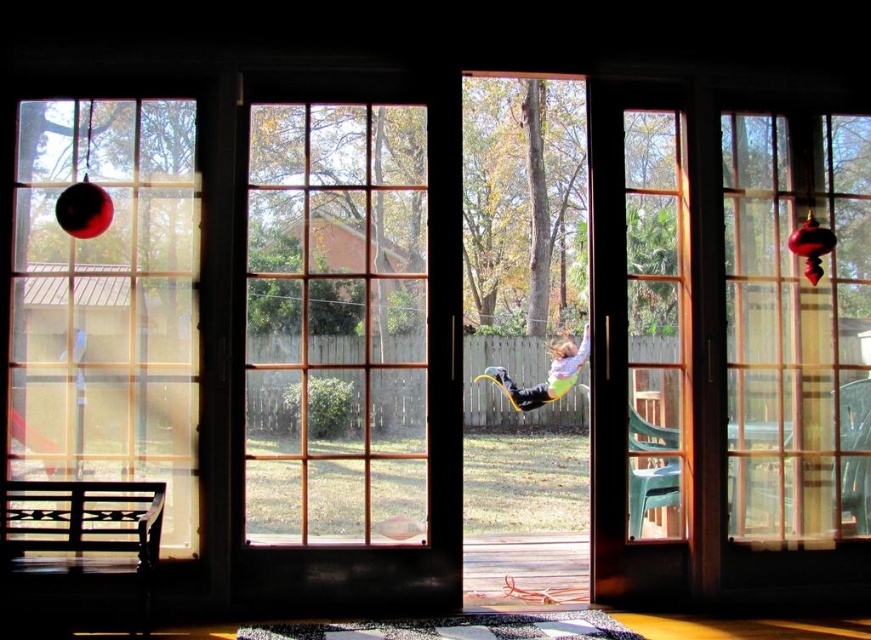
You are standing inside the house looking through the French doors. You see the multicolored plastic swing at center and the shiny red ornament at left. Which object is positioned lower in the scene?

The multicolored plastic swing at center is positioned lower than the shiny red ornament at left.

You are planning to hang a new decoration in your backyard. You have two options from the image, the multicolored plastic swing at center and the shiny red ornament at left. Which one requires a wider space to install?

The multicolored plastic swing at center requires a wider space to install since its width is larger than the shiny red ornament at left.